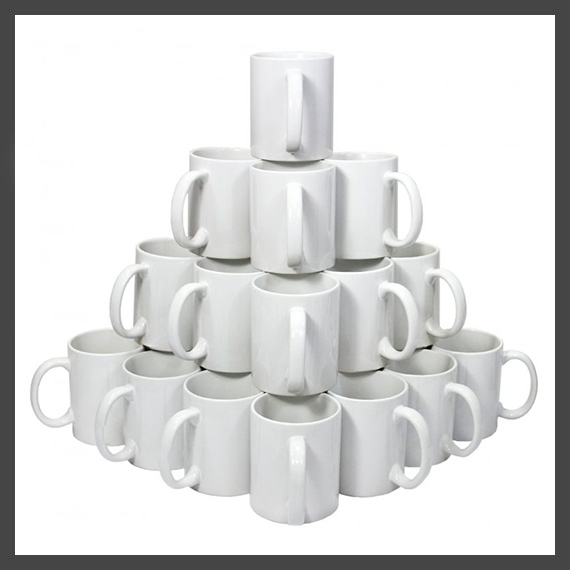
Locate an element on the screen. This screenshot has height=570, width=570. coffee mugs visible in bottom row is located at coordinates (96, 374), (157, 397), (215, 429), (268, 454), (360, 453), (439, 401), (492, 377).